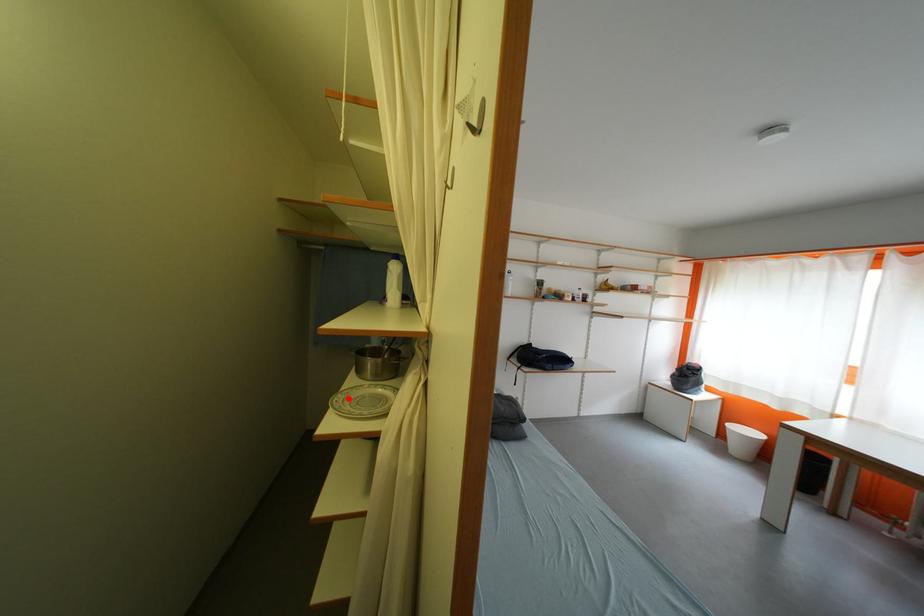
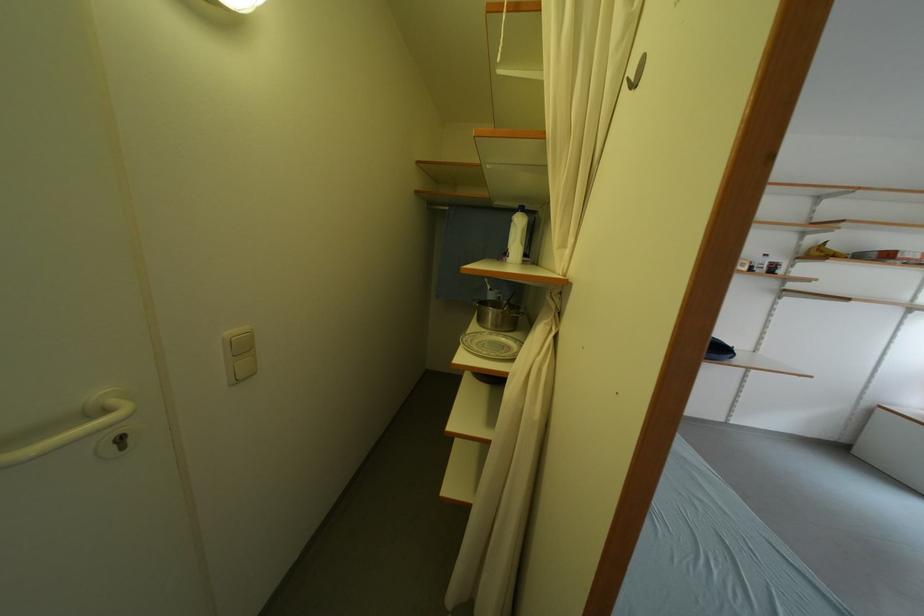
In the second image, find the point that corresponds to the highlighted location in the first image.

(476, 339)